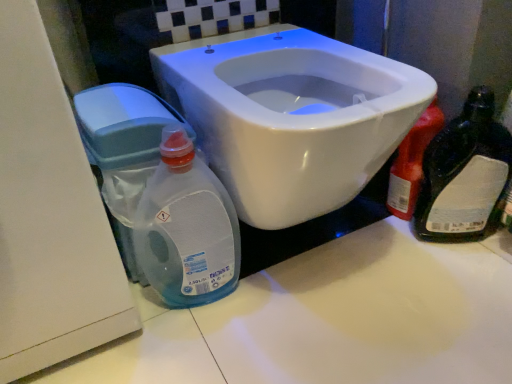
Identify the location of vacant space positioned to the left of translucent plastic bottle at right. The width and height of the screenshot is (512, 384). (348, 228).